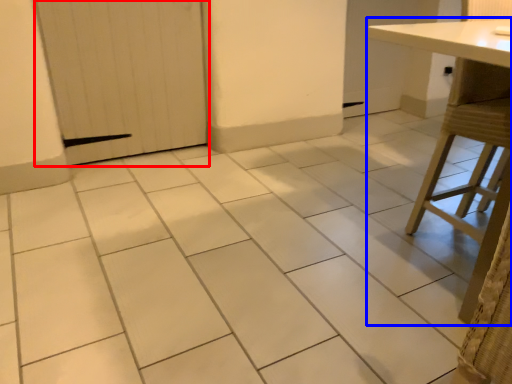
Question: Among these objects, which one is nearest to the camera, door (highlighted by a red box) or table (highlighted by a blue box)?

Choices:
 (A) door
 (B) table

Answer: (B)